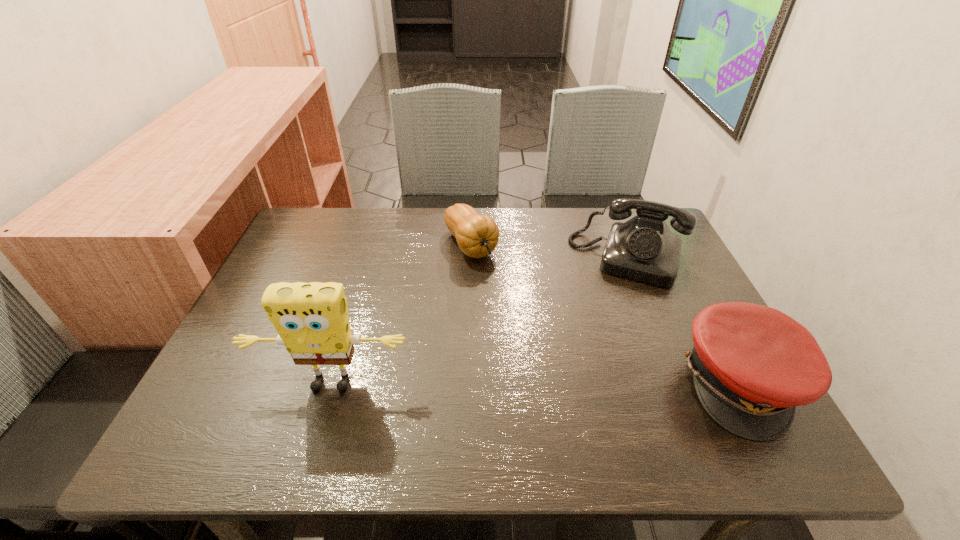
Locate an element on the screen. The image size is (960, 540). free space on the desktop that is between the leftmost object and the cap and is positioned on the stem side of the third object from right to left is located at coordinates (582, 383).

Locate an element on the screen. vacant space on the desktop that is between the leftmost object and the cap and is positioned on the dial of the telephone is located at coordinates (596, 383).